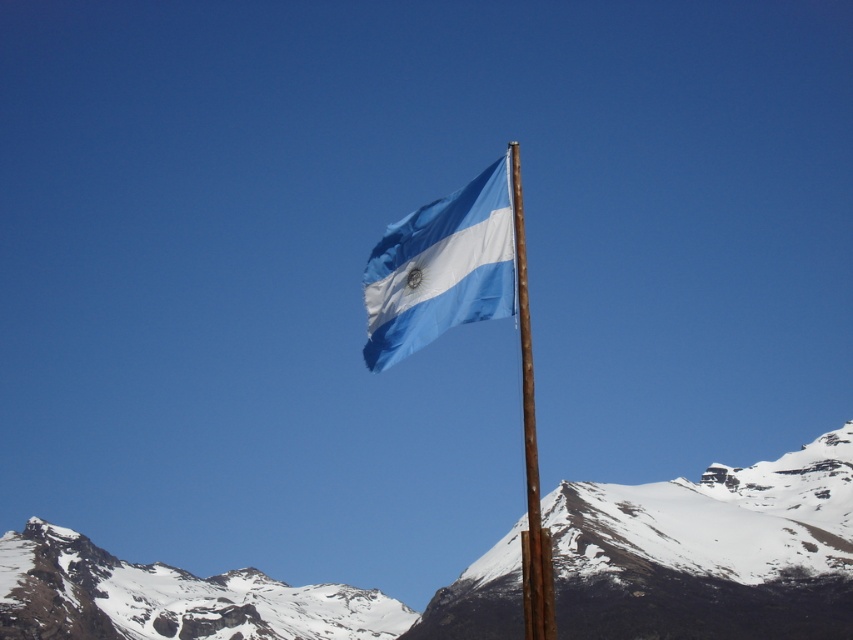
You are standing in front of the flagpole and want to touch both the snowy rock at center and the blue fabric flag at center. Which object will you reach first?

You will reach the snowy rock at center first because it is closer to you than the blue fabric flag at center, which is further away.

You are standing at the base of the flagpole and want to reach the point marked as point (711, 550) in the image. What is the most direct path to reach this point from the flagpole?

The most direct path to reach point (711, 550) from the flagpole would be to head towards the snowy rock at center where the point is located.

You are a photographer planning to capture the Argentine flag and its flagpole against the snowy mountain backdrop. Based on the scene, which object is shorter between the blue fabric flag at center and the rusty wood flag pole at center?

The blue fabric flag at center is shorter than the rusty wood flag pole at center.